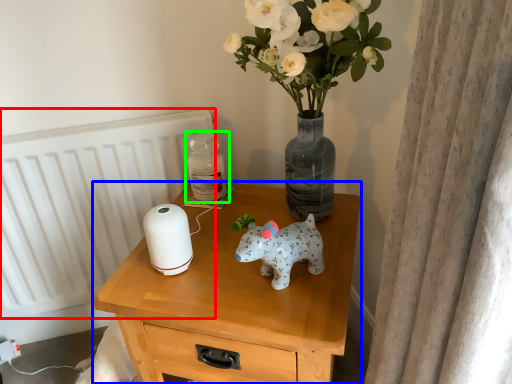
Question: Which is nearer to the radiator (highlighted by a red box)? nightstand (highlighted by a blue box) or bottle (highlighted by a green box).

Choices:
 (A) nightstand
 (B) bottle

Answer: (B)